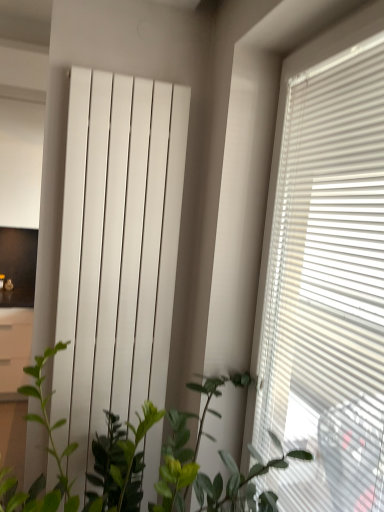
Question: From the image's perspective, does white glossy file cabinet at left appear higher than green leafy plant at center?

Choices:
 (A) yes
 (B) no

Answer: (B)

Question: Can you confirm if white glossy file cabinet at left is wider than green leafy plant at center?

Choices:
 (A) yes
 (B) no

Answer: (B)

Question: Can you confirm if white glossy file cabinet at left is positioned to the left of green leafy plant at center?

Choices:
 (A) yes
 (B) no

Answer: (A)

Question: Can we say white glossy file cabinet at left lies outside green leafy plant at center?

Choices:
 (A) yes
 (B) no

Answer: (A)

Question: Considering the relative positions of white glossy file cabinet at left and green leafy plant at center in the image provided, is white glossy file cabinet at left behind green leafy plant at center?

Choices:
 (A) yes
 (B) no

Answer: (A)

Question: Are white glossy file cabinet at left and green leafy plant at center making contact?

Choices:
 (A) no
 (B) yes

Answer: (A)

Question: From the image's perspective, would you say green leafy plant at center is shown under white glossy file cabinet at left?

Choices:
 (A) no
 (B) yes

Answer: (A)

Question: Is white glossy file cabinet at left a part of green leafy plant at center?

Choices:
 (A) no
 (B) yes

Answer: (A)

Question: From a real-world perspective, is green leafy plant at center on white glossy file cabinet at left?

Choices:
 (A) no
 (B) yes

Answer: (B)

Question: Can you confirm if green leafy plant at center is thinner than white glossy file cabinet at left?

Choices:
 (A) yes
 (B) no

Answer: (B)

Question: Considering the relative sizes of green leafy plant at center and white glossy file cabinet at left in the image provided, is green leafy plant at center shorter than white glossy file cabinet at left?

Choices:
 (A) no
 (B) yes

Answer: (A)

Question: Is green leafy plant at center not near white glossy file cabinet at left?

Choices:
 (A) yes
 (B) no

Answer: (A)

Question: Is white glossy radiator at center outside white glossy file cabinet at left?

Choices:
 (A) no
 (B) yes

Answer: (B)